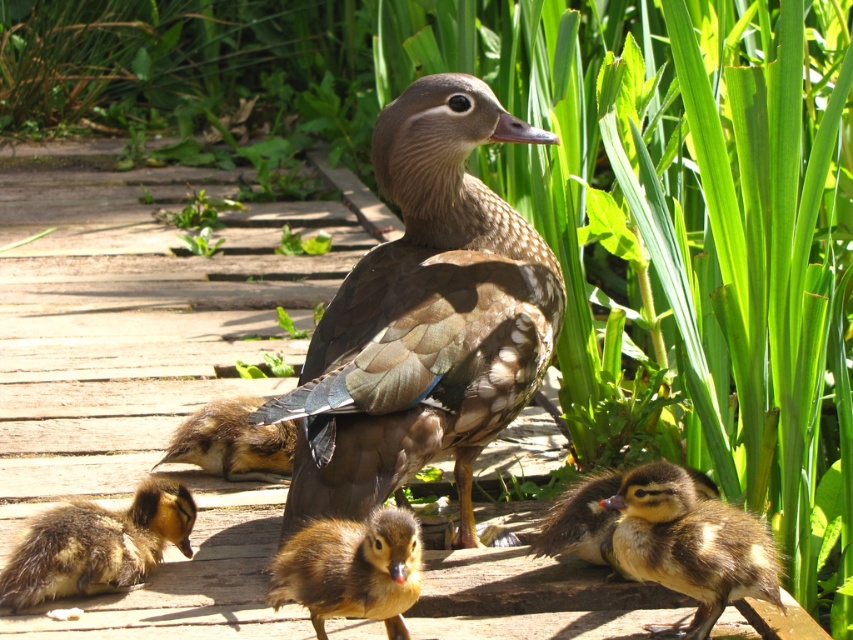
You are a birdwatcher observing the mother duck and her ducklings. You notice the brown speckled feathers at center and the brown fuzzy duckling at center. Which one is bigger?

The brown speckled feathers at center is larger in size than the brown fuzzy duckling at center.

You are a photographer trying to capture the mother duck and her ducklings. You notice the brown speckled feathers at center and the brown fuzzy duckling at lower right. Which object is positioned closer to you? Please explain based on their positions in the image.

The brown speckled feathers at center is closer to the viewer than the brown fuzzy duckling at lower right, so it appears nearer in the image.

You are a photographer aiming to capture a closeup of the brown fluffy duckling at lower left and the brown fuzzy duckling at center. Which duckling requires you to adjust your camera lens to a wider angle to accommodate its size?

The brown fluffy duckling at lower left might be wider than the brown fuzzy duckling at center, so you would need to adjust your camera lens to a wider angle for the brown fluffy duckling at lower left to capture its entire size.